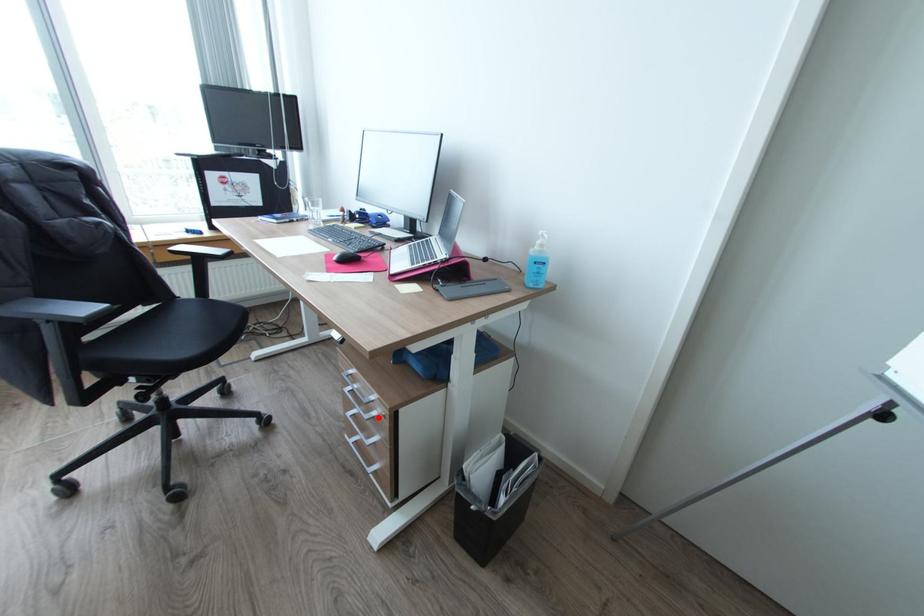
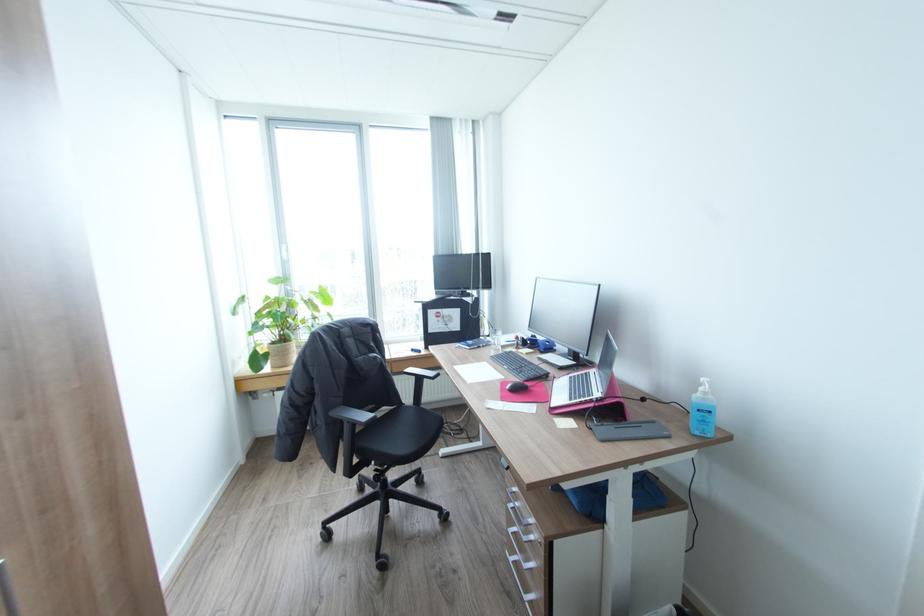
Question: I am providing you with two images of the same scene from different viewpoints. Image1 has a red point marked. In image2, the corresponding 3D location appears at what relative position? Reply with the corresponding letter.

Choices:
 (A) Closer
 (B) Farther

Answer: (A)